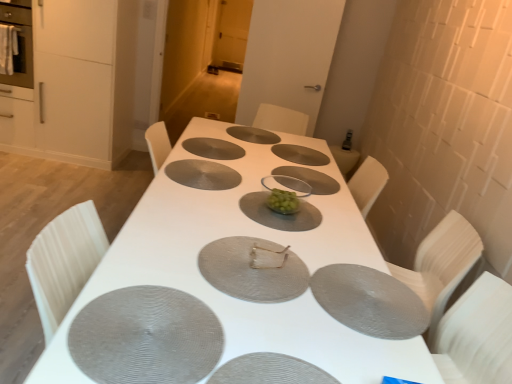
You are a GUI agent. You are given a task and a screenshot of the screen. Output one action in this format:
    pyautogui.click(x=<x>, y=<y>)
    Task: Click on the vacant region to the left of clear plastic plate at center
    The image size is (512, 384).
    Given the screenshot: What is the action you would take?
    pyautogui.click(x=239, y=167)